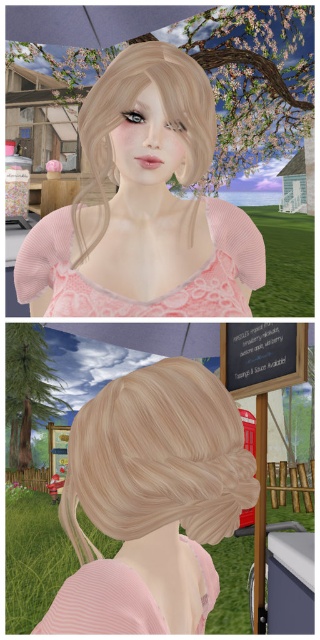
Question: Which object is closer to the camera taking this photo?

Choices:
 (A) matte pink sweater at center
 (B) blonde textured hair at center

Answer: (B)

Question: Considering the relative positions of blonde wood hair bun at upper center and blondehair at upper center in the image provided, where is blonde wood hair bun at upper center located with respect to blondehair at upper center?

Choices:
 (A) right
 (B) left

Answer: (A)

Question: Which point appears farthest from the camera in this image?

Choices:
 (A) (106, 172)
 (B) (69, 525)

Answer: (A)

Question: Which point is closer to the camera?

Choices:
 (A) (89, 556)
 (B) (250, 467)
 (C) (157, 113)
 (D) (120, 64)

Answer: (B)

Question: Does matte pink sweater at center lie behind blondehair at upper center?

Choices:
 (A) yes
 (B) no

Answer: (A)

Question: Is matte pink sweater at center wider than blondehair at upper center?

Choices:
 (A) no
 (B) yes

Answer: (B)